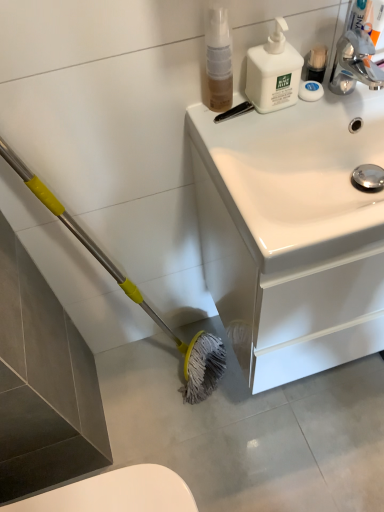
Question: Would you say translucent plastic spray bottle at upper center, marked as the 1th cleaning product in a left-to-right arrangement, is to the left or to the right of white glossy sink at upper right in the picture?

Choices:
 (A) left
 (B) right

Answer: (A)

Question: In terms of width, does translucent plastic spray bottle at upper center, placed as the 2th cleaning product when sorted from right to left, look wider or thinner when compared to white glossy sink at upper right?

Choices:
 (A) thin
 (B) wide

Answer: (A)

Question: Which of these objects is positioned farthest from the white matte pump bottle at upper right, the second cleaning product in the left-to-right sequence?

Choices:
 (A) translucent plastic spray bottle at upper center, placed as the 2th cleaning product when sorted from right to left
 (B) white glossy sink at upper right
 (C) white matte soap at upper right

Answer: (B)

Question: Estimate the real-world distances between objects in this image. Which object is closer to the white matte soap at upper right?

Choices:
 (A) white matte pump bottle at upper right, the second cleaning product in the left-to-right sequence
 (B) white glossy sink at upper right
 (C) translucent plastic spray bottle at upper center, placed as the 2th cleaning product when sorted from right to left

Answer: (A)